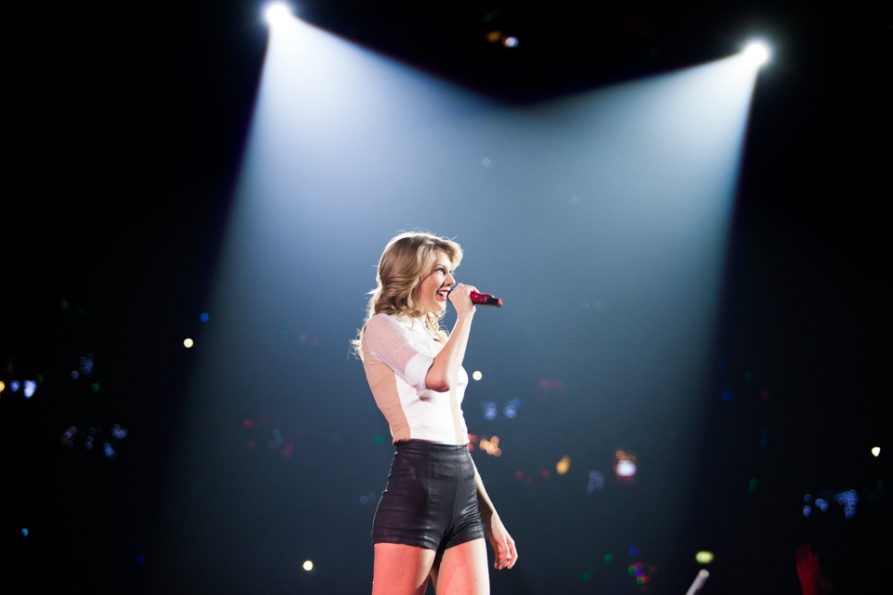
You are a GUI agent. You are given a task and a screenshot of the screen. Output one action in this format:
    pyautogui.click(x=<x>, y=<y>)
    Task: Click on the spotlight
    The height and width of the screenshot is (595, 893).
    Given the screenshot: What is the action you would take?
    pyautogui.click(x=271, y=14), pyautogui.click(x=754, y=56)